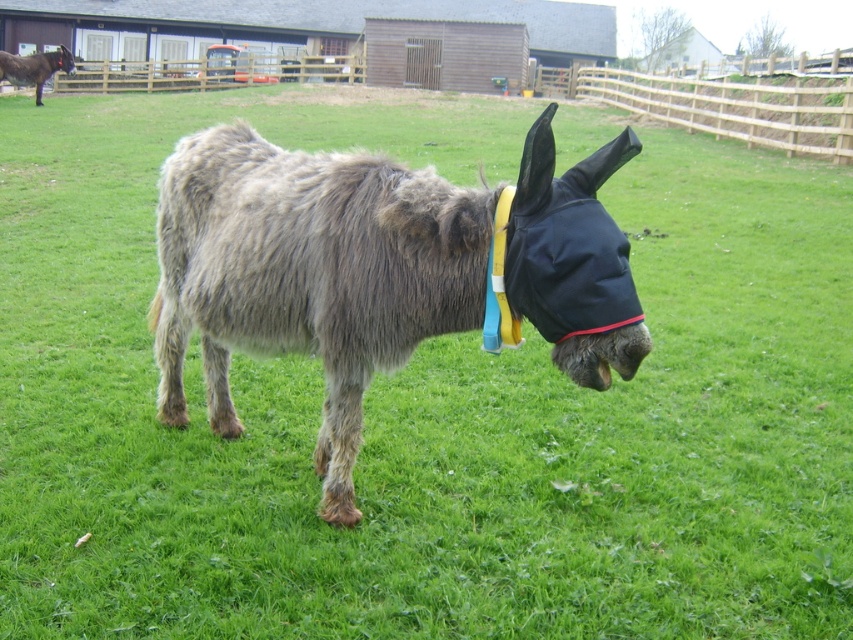
You are a farmer checking on your animals. You see the fuzzy gray donkey at center and the brown fuzzy mule at upper left. Which animal is nearer to you?

The fuzzy gray donkey at center is closer to the viewer than the brown fuzzy mule at upper left, so the fuzzy gray donkey at center is nearer to you.

You are a farmer who needs to check on both the fuzzy gray donkey at center and the brown fuzzy mule at upper left. If you start from your current position at the fence, which animal will require you to walk a shorter distance?

The fuzzy gray donkey at center is 26.78 meters away from the brown fuzzy mule at upper left. Since you are starting from the fence, the distance to each animal depends on their positions relative to the fence. However, without specific distances from the fence to each animal, we cannot determine which requires a shorter walk.